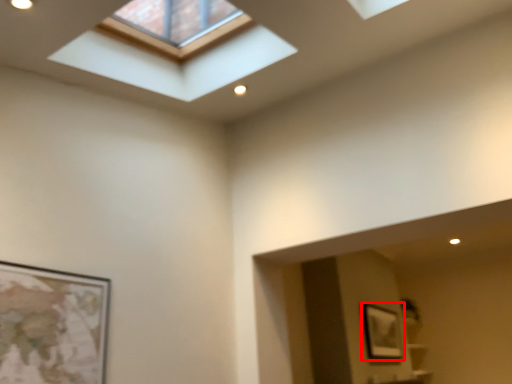
Question: From the image's perspective, what is the correct spatial positioning of picture frame (annotated by the red box) in reference to window?

Choices:
 (A) below
 (B) above

Answer: (A)